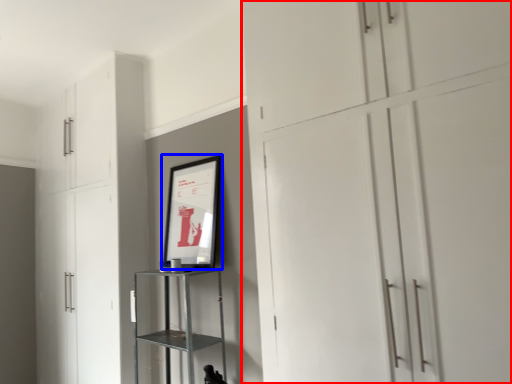
Question: Which point is closer to the camera, cupboard (highlighted by a red box) or picture frame (highlighted by a blue box)?

Choices:
 (A) cupboard
 (B) picture frame

Answer: (A)